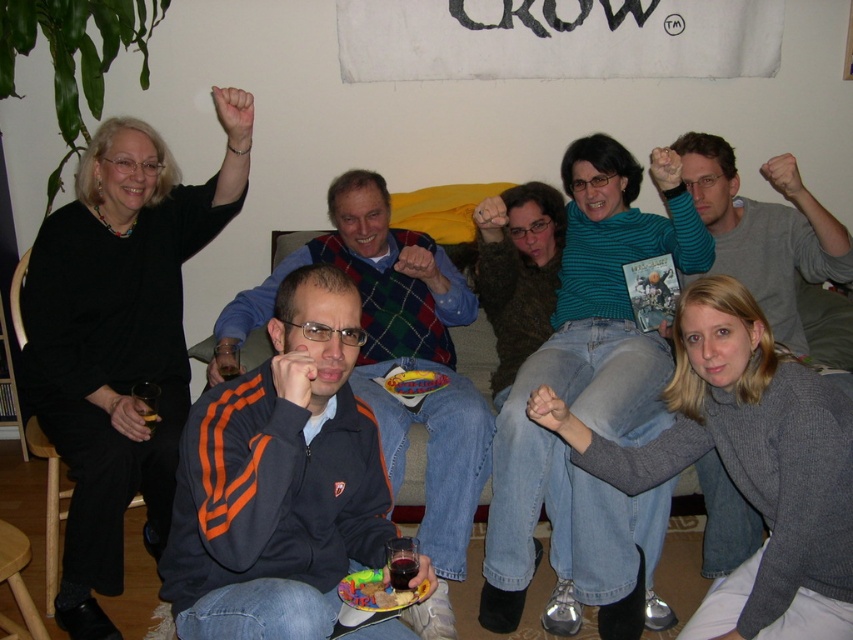
You are organizing a charity clothing drive and need to determine which items can fit into a donation box that has a maximum width of 40 cm. You have two sweaters to assess from the image. Which sweater, the knitted gray sweater at lower right or the gray sweater at center, is more likely to exceed the width limit?

The knitted gray sweater at lower right might be wider than gray sweater at center, so it is more likely to exceed the 40 cm width limit and should be checked first.